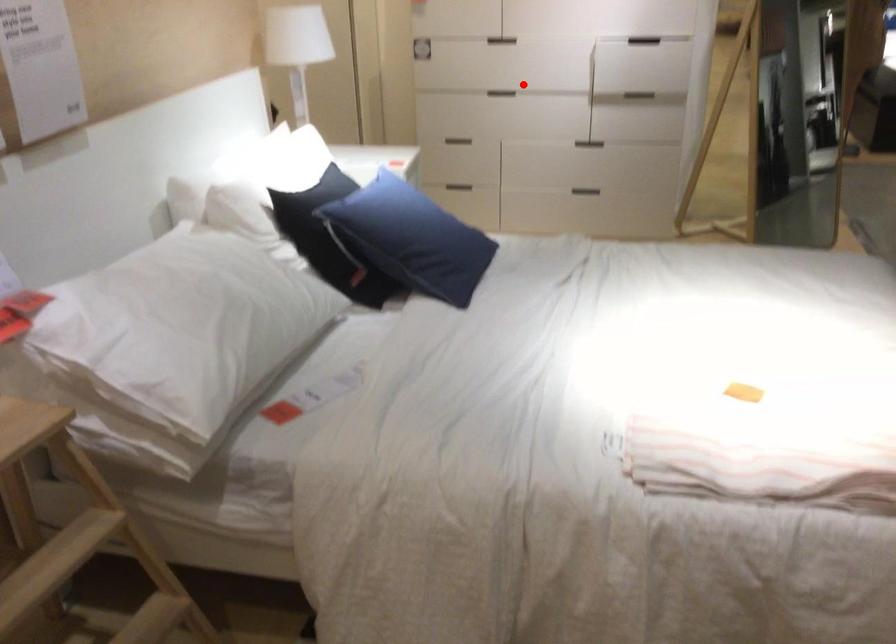
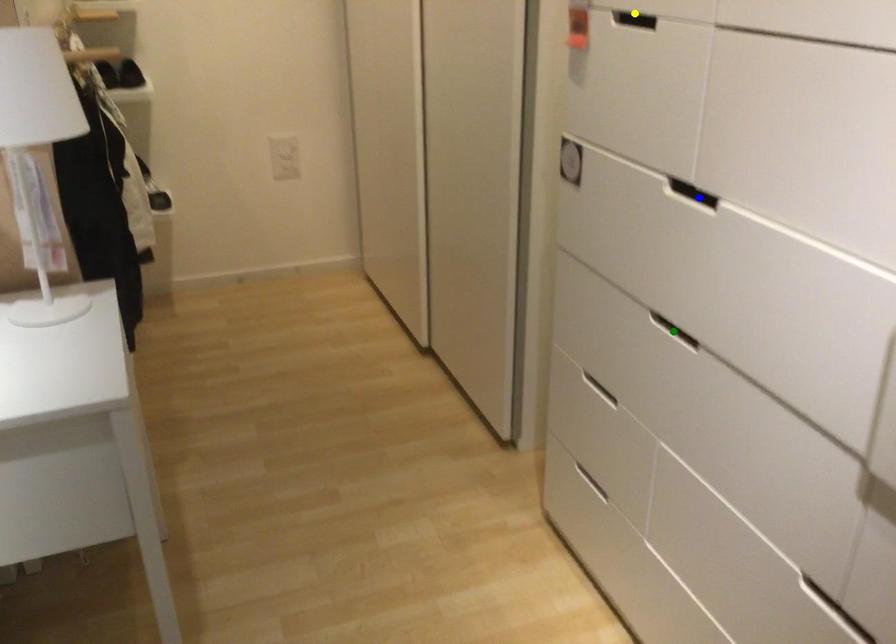
Question: I am providing you with two images of the same scene from different viewpoints. A red point is marked on the first image. You are given multiple points on the second image. Which spot in image 2 lines up with the point in image 1?

Choices:
 (A) yellow point
 (B) green point
 (C) blue point

Answer: (B)